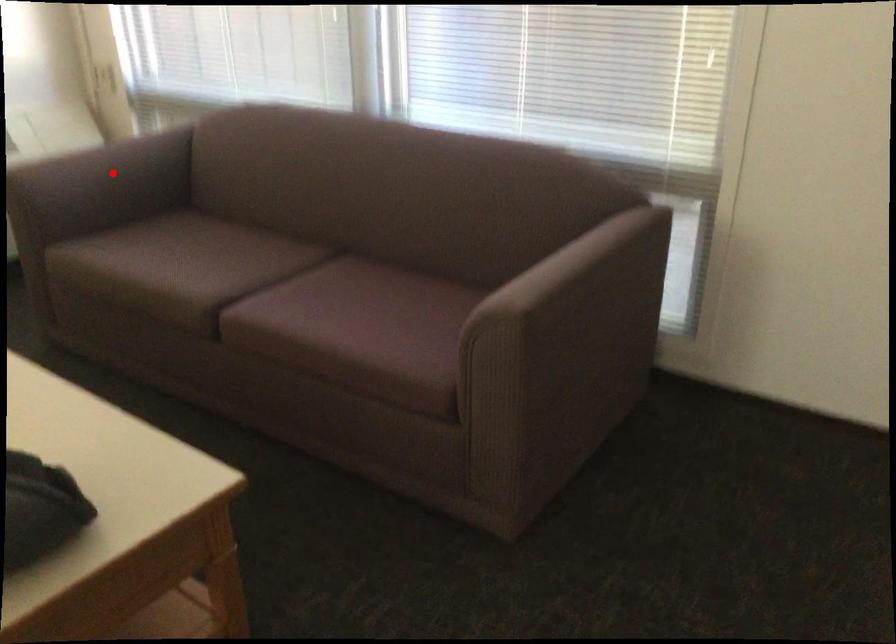
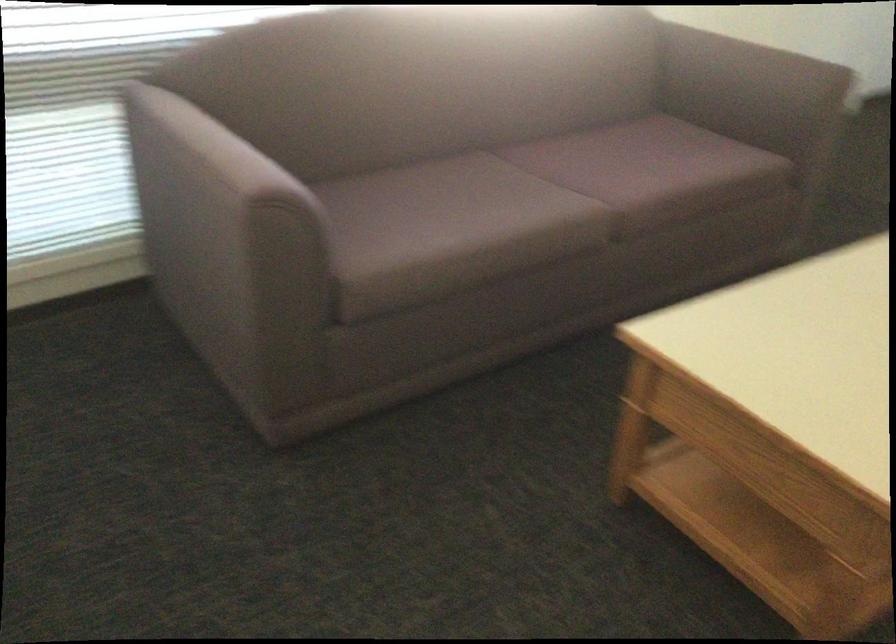
Question: I am providing you with two images of the same scene from different viewpoints. A red point is marked on the first image. Is the red point's position out of view in image 2?

Choices:
 (A) Yes
 (B) No

Answer: (A)